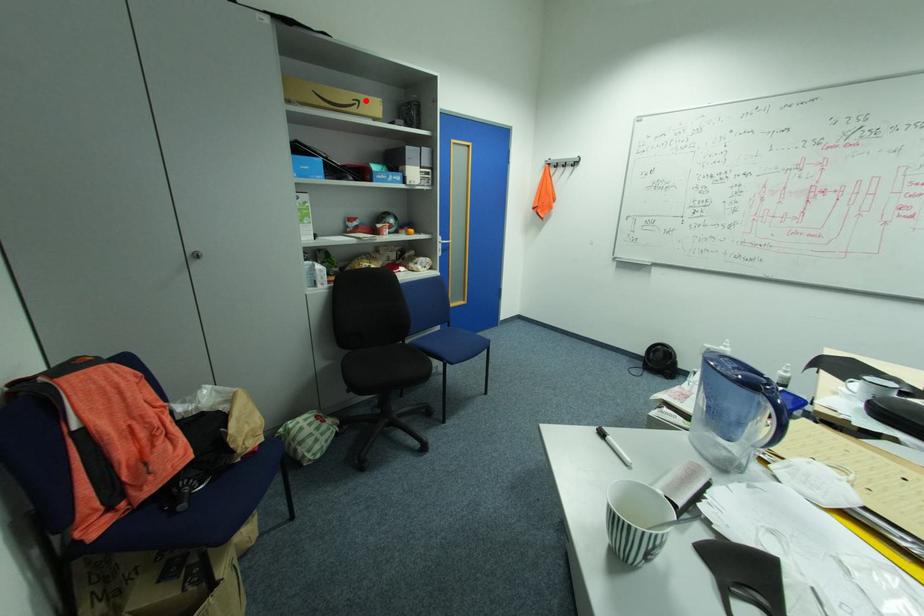
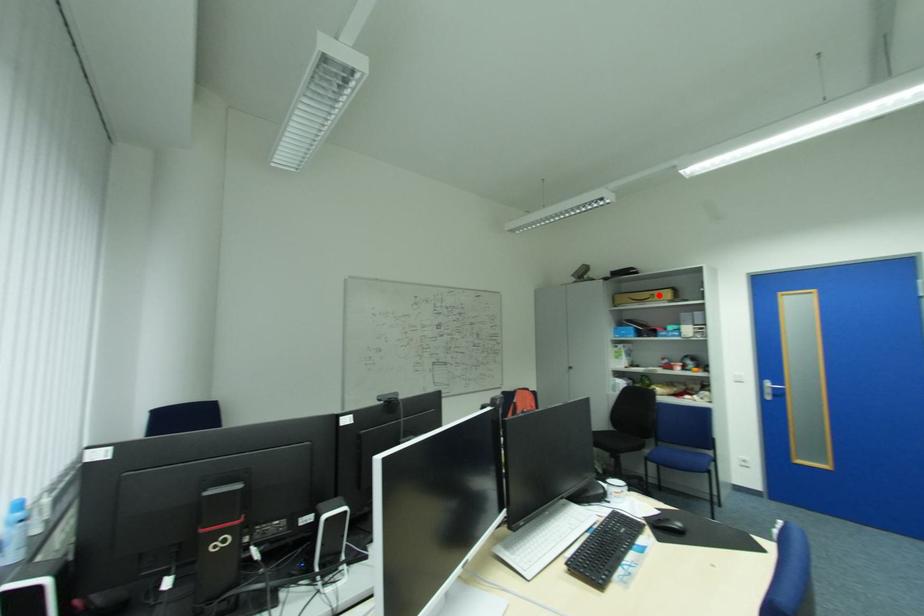
I am providing you with two images of the same scene from different viewpoints. A red point is marked on the first image and another point is marked on the second image. Do the highlighted points in image1 and image2 indicate the same real-world spot?

Yes